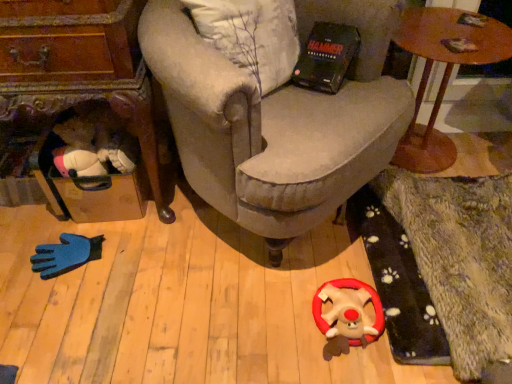
Image resolution: width=512 pixels, height=384 pixels. In order to click on blank area beneath fluffy plush toy at center (from a real-world perspective) in this screenshot , I will do `click(350, 347)`.